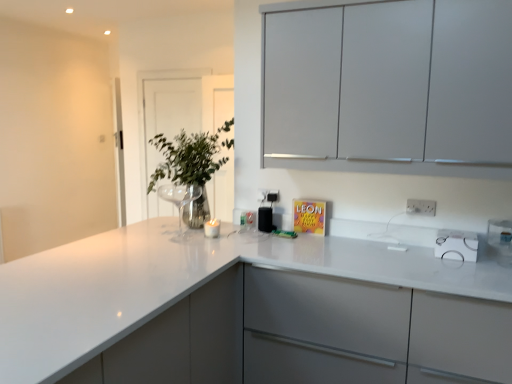
Where is `empty space that is ontop of transparent glass door at upper center`? The height and width of the screenshot is (384, 512). empty space that is ontop of transparent glass door at upper center is located at coordinates (172, 67).